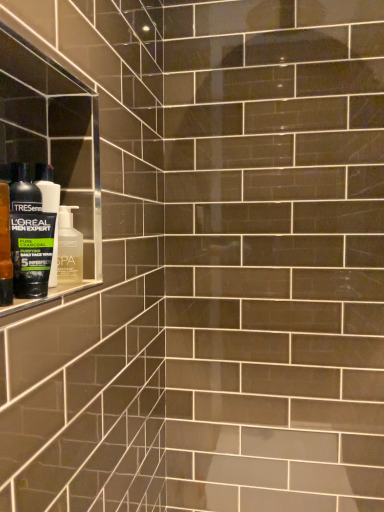
This screenshot has width=384, height=512. What are the coordinates of `matte glass shelf at left` in the screenshot? It's located at (49, 295).

Measure the distance between point (13, 300) and camera.

Point (13, 300) is 23.94 inches from camera.

What do you see at coordinates (49, 295) in the screenshot? I see `matte glass shelf at left` at bounding box center [49, 295].

This screenshot has width=384, height=512. Identify the location of matte glass shelf at left. (49, 295).